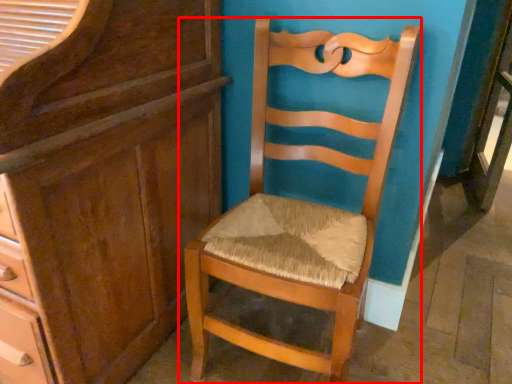
Question: Where is chair (annotated by the red box) located in relation to cabinetry in the image?

Choices:
 (A) right
 (B) left

Answer: (A)